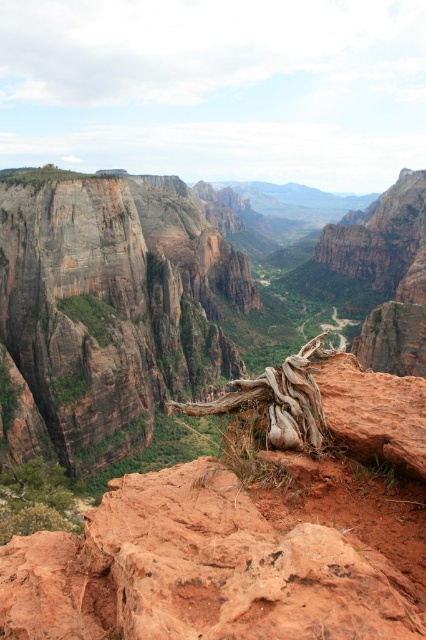
You are a drone operator trying to capture a photo of the rustic brown cliff at upper left. The drone has a camera with a 120 degree field of view. You are currently positioned at point 0.5, 0.25. Can you capture the cliff in your current position?

The rustic brown cliff at upper left is located at point (108, 310). Since your current position is at (106, 320), which is very close to the cliff, the 120 degree field of view should easily capture the cliff in your current position.

You are a hiker planning to descend from the rustic brown cliff at upper left to the rustic rock canyon at center. Based on the scene, is the path between them going downward or upward?

The path between the rustic rock canyon at center and the rustic brown cliff at upper left is going downward because the rustic rock canyon at center is located above the rustic brown cliff at upper left, so descending from the cliff to the canyon would require going downward.

You are a hiker standing at the edge of the rustic rock canyon at center and looking towards the brown rough tree root at center. Which object is closer to you?

The rustic rock canyon at center is closer to you because it is in front of the brown rough tree root at center.